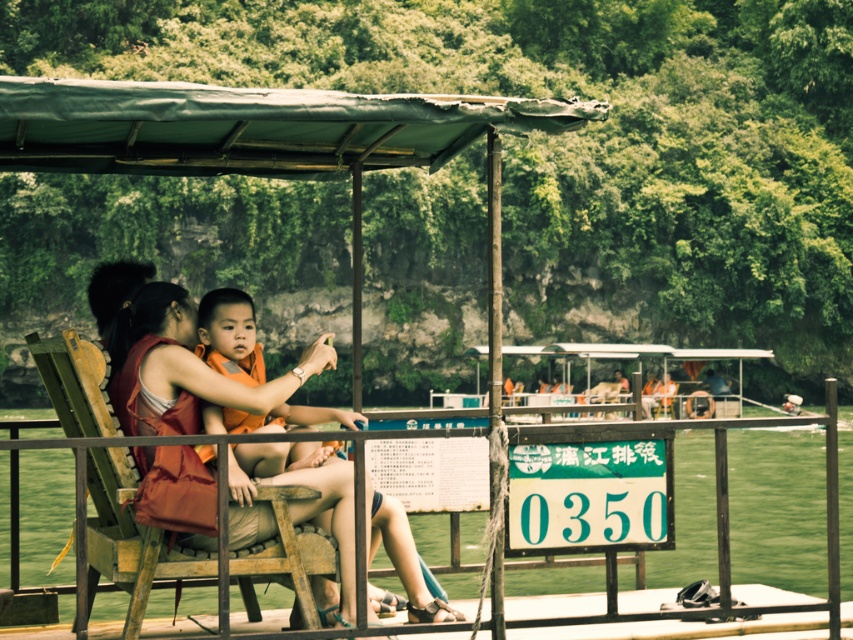
Is green fabric canopy at upper center taller than orange fabric life jacket at center?

Indeed, green fabric canopy at upper center has a greater height compared to orange fabric life jacket at center.

Can you confirm if green fabric canopy at upper center is wider than orange fabric life jacket at center?

Correct, the width of green fabric canopy at upper center exceeds that of orange fabric life jacket at center.

This screenshot has width=853, height=640. What do you see at coordinates (251, 125) in the screenshot?
I see `green fabric canopy at upper center` at bounding box center [251, 125].

Where is `green fabric canopy at upper center`? The image size is (853, 640). green fabric canopy at upper center is located at coordinates (x=251, y=125).

Which is in front, point (99, 172) or point (158, 292)?

Point (158, 292)

Which is in front, point (143, 145) or point (166, 330)?

Point (166, 330)

This screenshot has height=640, width=853. In order to click on green fabric canopy at upper center in this screenshot , I will do `click(251, 125)`.

Does matte red life vest at center have a lesser height compared to orange fabric life jacket at center?

Indeed, matte red life vest at center has a lesser height compared to orange fabric life jacket at center.

Who is more distant from viewer, (257,529) or (223,422)?

Positioned behind is point (223,422).

The image size is (853, 640). In order to click on matte red life vest at center in this screenshot , I will do `click(181, 365)`.